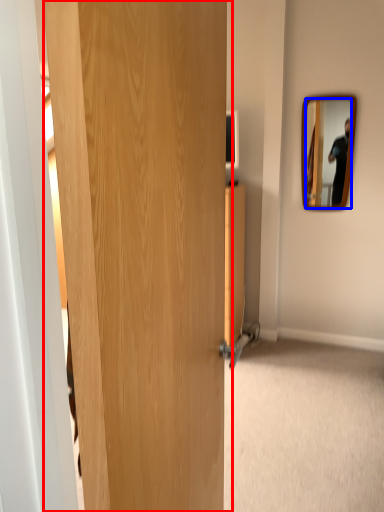
Question: Which point is further to the camera, door (highlighted by a red box) or mirror (highlighted by a blue box)?

Choices:
 (A) door
 (B) mirror

Answer: (B)